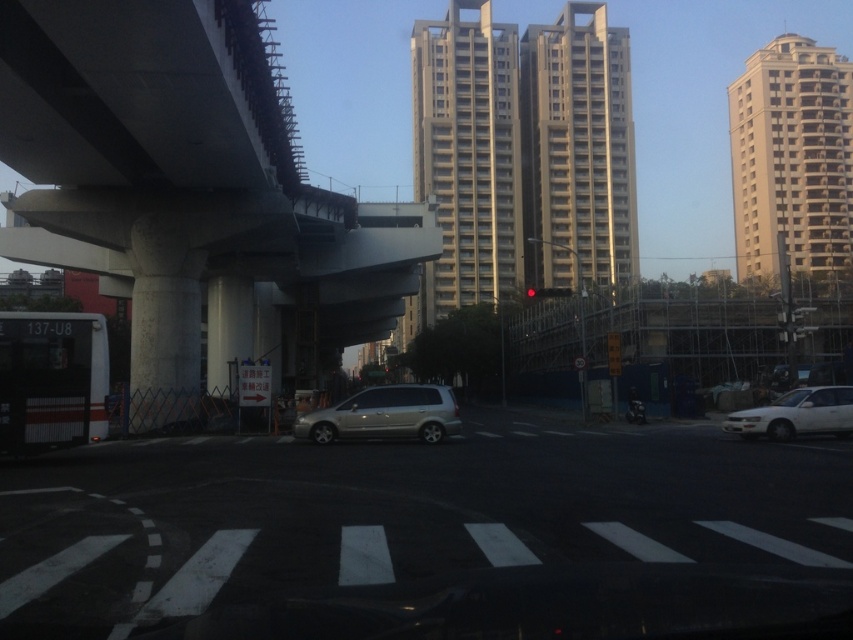
Question: Does concrete at left appear over concrete at center?

Choices:
 (A) yes
 (B) no

Answer: (B)

Question: Is beige concrete building at center smaller than satin silver minivan at center?

Choices:
 (A) yes
 (B) no

Answer: (B)

Question: Considering the real-world distances, which object is closest to the gray concrete building at center?

Choices:
 (A) white matte sedan at right
 (B) white concrete building at upper right
 (C) beige concrete building at center

Answer: (C)

Question: Which point appears farthest from the camera in this image?

Choices:
 (A) (303, 432)
 (B) (102, 266)
 (C) (532, 288)
 (D) (817, 412)

Answer: (C)

Question: Observing the image, what is the correct spatial positioning of white concrete building at upper right in reference to red glass traffic light at center?

Choices:
 (A) above
 (B) below

Answer: (A)

Question: Based on their relative distances, which object is nearer to the gray concrete building at center?

Choices:
 (A) concrete at center
 (B) red glass traffic light at center
 (C) beige concrete building at center

Answer: (C)